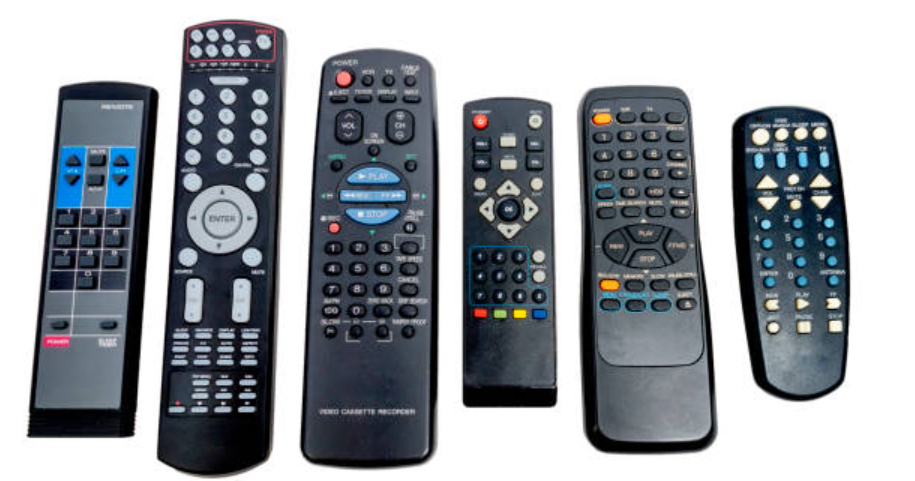
Locate an element on the screen. remotes is located at coordinates (91, 258), (195, 241), (357, 229), (508, 245), (636, 258), (780, 253).